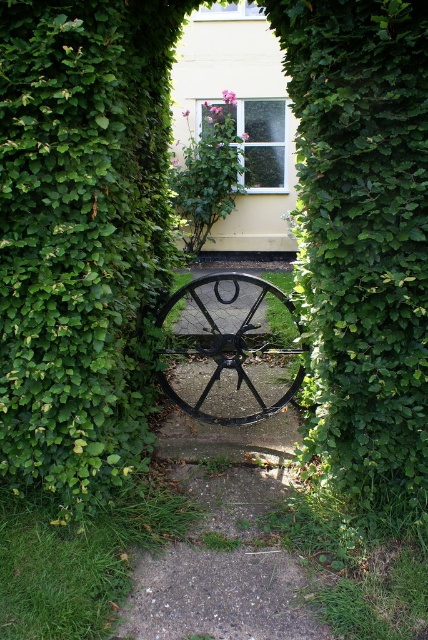
Question: Which point is closer to the camera?

Choices:
 (A) green leafy bush at center
 (B) black metal wheel at center
 (C) black matte wagon wheel at center

Answer: (A)

Question: Is green leafy bush at center to the left of black metal wheel at center from the viewer's perspective?

Choices:
 (A) yes
 (B) no

Answer: (B)

Question: Can you confirm if green leafy bush at center is bigger than black matte wagon wheel at center?

Choices:
 (A) no
 (B) yes

Answer: (A)

Question: Considering the real-world distances, which object is farthest from the green leafy bush at center?

Choices:
 (A) black matte wagon wheel at center
 (B) black metal wheel at center

Answer: (A)

Question: Can you confirm if green leafy bush at center is thinner than black metal wheel at center?

Choices:
 (A) yes
 (B) no

Answer: (A)

Question: Which point is closer to the camera taking this photo?

Choices:
 (A) (350, 10)
 (B) (180, 378)
 (C) (297, 385)

Answer: (A)